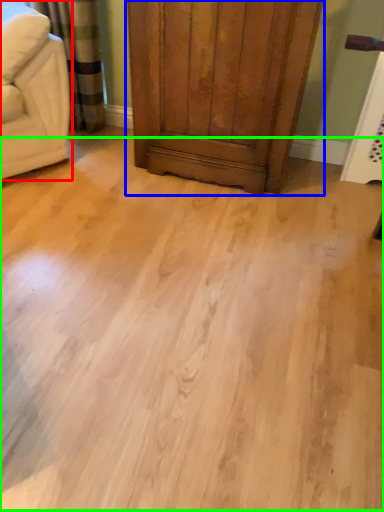
Question: Which is nearer to the furniture (highlighted by a red box)? dresser (highlighted by a blue box) or plain (highlighted by a green box).

Choices:
 (A) dresser
 (B) plain

Answer: (A)